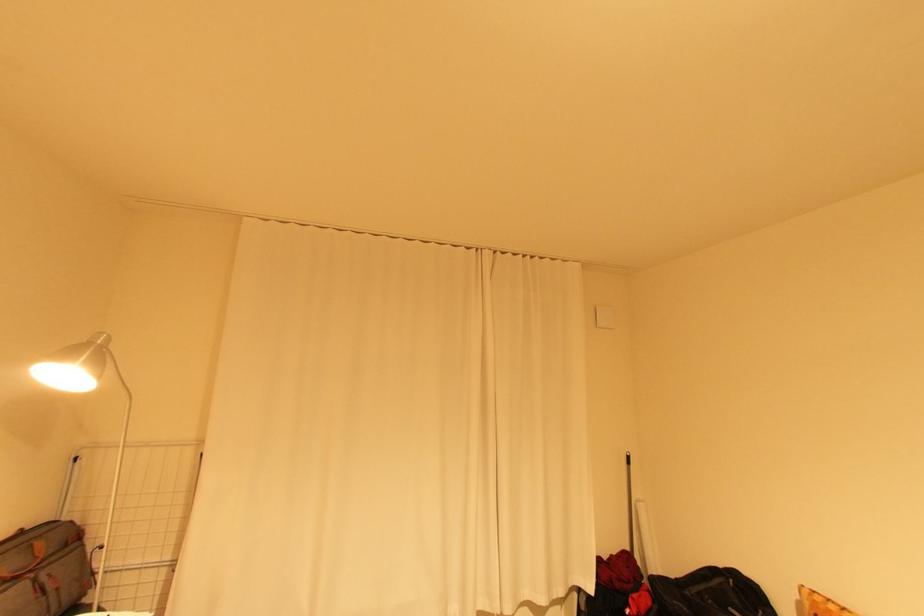
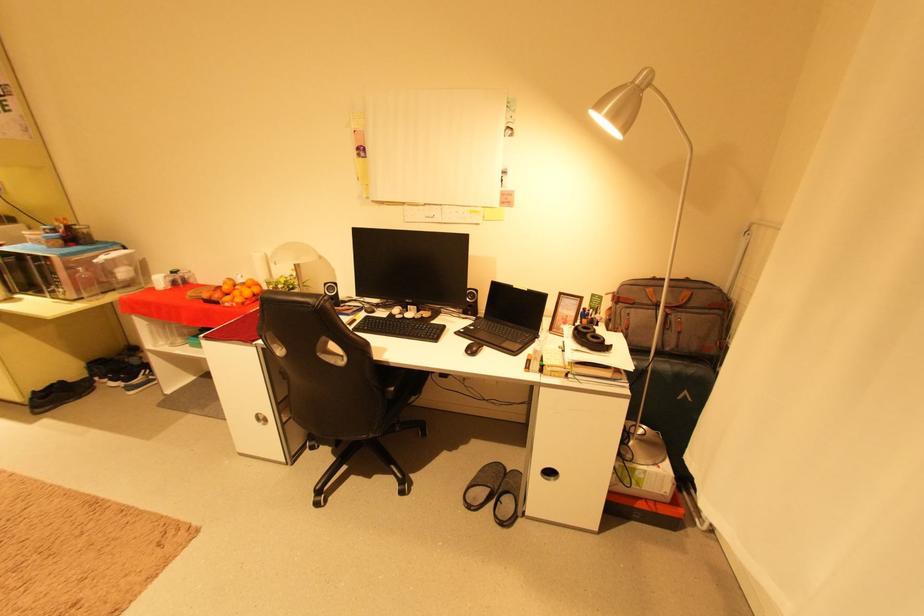
In the second image, find the point that corresponds to [34,544] in the first image.

(688, 290)